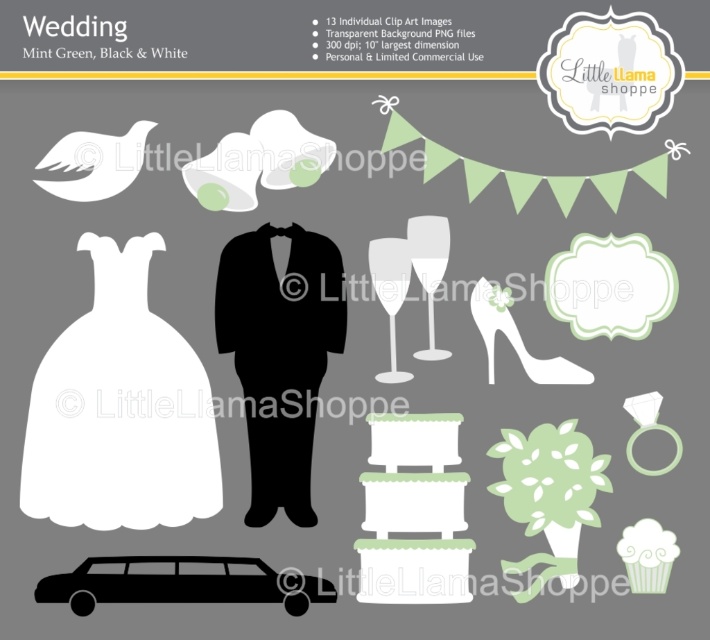
Question: From the image, what is the correct spatial relationship of white matte dress at left in relation to black matte limousine at lower left?

Choices:
 (A) below
 (B) above

Answer: (B)

Question: Which point is farther to the camera?

Choices:
 (A) black matte limousine at lower left
 (B) white matte dress at left

Answer: (B)

Question: Which object appears farthest from the camera in this image?

Choices:
 (A) white matte dress at left
 (B) black matte limousine at lower left

Answer: (A)

Question: Can you confirm if white matte dress at left is positioned to the left of black matte limousine at lower left?

Choices:
 (A) yes
 (B) no

Answer: (A)

Question: Which point is closer to the camera taking this photo?

Choices:
 (A) (98, 236)
 (B) (290, 596)

Answer: (B)

Question: Does white matte dress at left have a smaller size compared to black matte limousine at lower left?

Choices:
 (A) yes
 (B) no

Answer: (B)